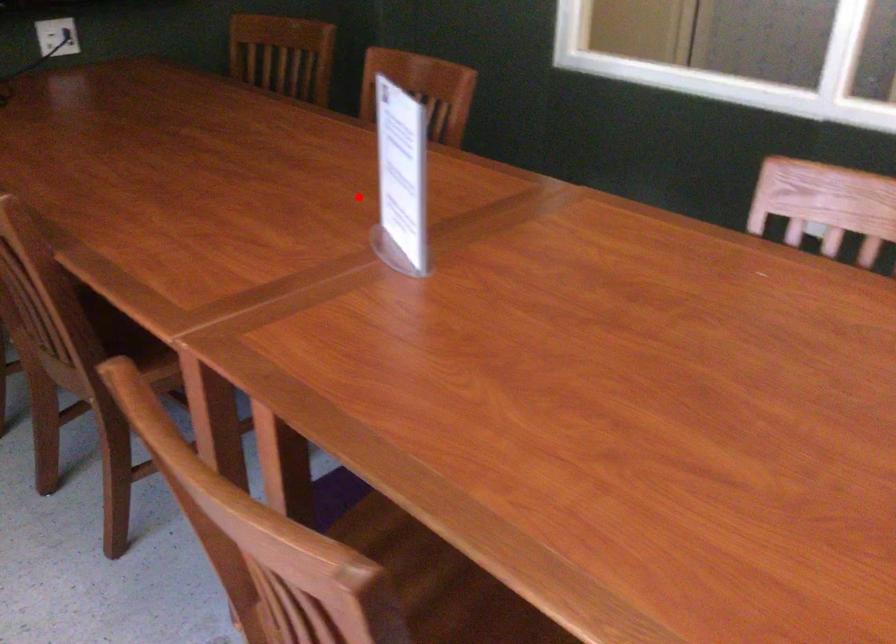
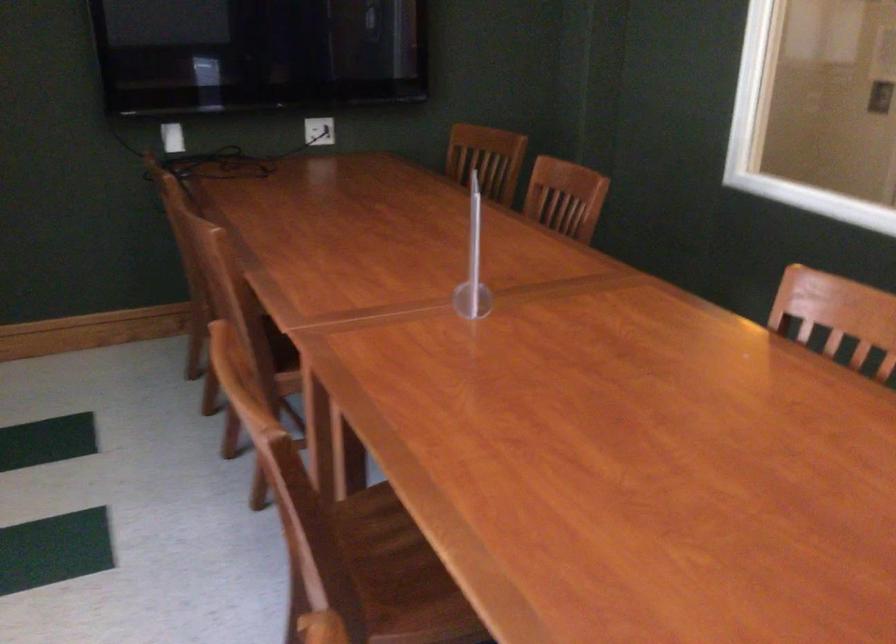
Locate, in the second image, the point that corresponds to the highlighted location in the first image.

(472, 263)